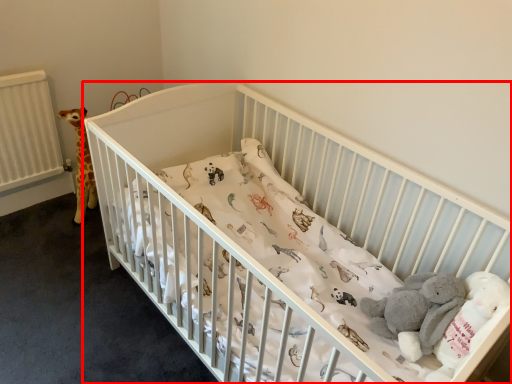
Question: From the image's perspective, where is infant bed (annotated by the red box) located in relation to baby elephant in the image?

Choices:
 (A) below
 (B) above

Answer: (B)